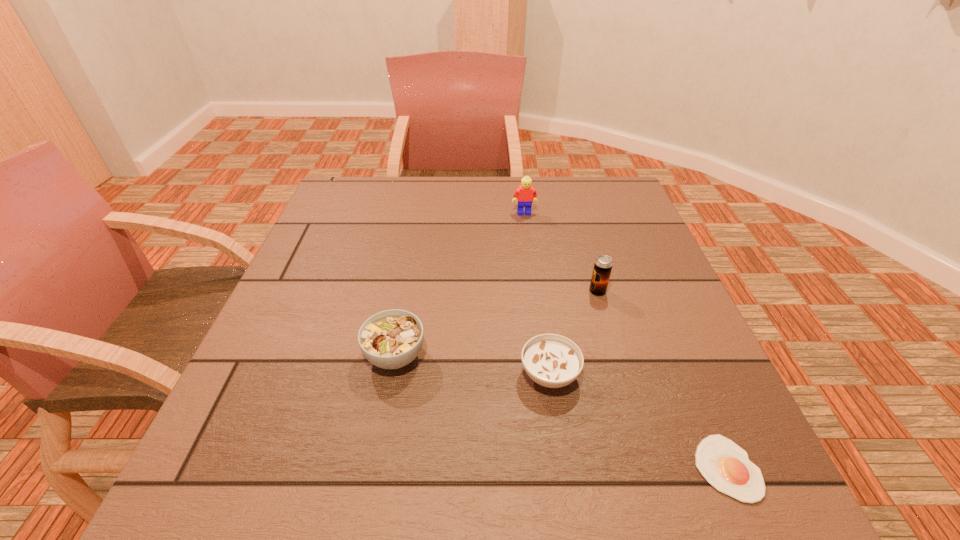
The image size is (960, 540). In order to click on free space between the rightmost object and the leftmost object in this screenshot , I will do `click(561, 411)`.

Locate an element on the screen. unoccupied position between the taller soup bowl and the fourth shortest object is located at coordinates tap(496, 323).

Where is `vacant space that is in between the third shortest object and the egg yolk`? Image resolution: width=960 pixels, height=540 pixels. vacant space that is in between the third shortest object and the egg yolk is located at coordinates (561, 411).

At what (x,y) coordinates should I click in order to perform the action: click on unoccupied area between the farthest object and the third shortest object. Please return your answer as a coordinate pair (x, y). Looking at the image, I should click on (460, 284).

At what (x,y) coordinates should I click in order to perform the action: click on vacant space that's between the right soup bowl and the third tallest object. Please return your answer as a coordinate pair (x, y). Looking at the image, I should click on (472, 365).

The image size is (960, 540). What are the coordinates of `object that is the closest one to the right soup bowl` in the screenshot? It's located at (726, 466).

Locate an element on the screen. This screenshot has height=540, width=960. object that is the closest to the fourth nearest object is located at coordinates (553, 361).

Find the location of `vacant point that satisfies the following two spatial constraints: 1. on the front side of the shorter soup bowl; 2. on the right side of the third tallest object`. vacant point that satisfies the following two spatial constraints: 1. on the front side of the shorter soup bowl; 2. on the right side of the third tallest object is located at coordinates (392, 374).

Find the location of a particular element. Image resolution: width=960 pixels, height=540 pixels. vacant space that satisfies the following two spatial constraints: 1. on the front-facing side of the shorter soup bowl; 2. on the right side of the tallest object is located at coordinates (546, 374).

Find the location of `free space in the image that satisfies the following two spatial constraints: 1. on the front-facing side of the shortest object; 2. on the left side of the tallest object`. free space in the image that satisfies the following two spatial constraints: 1. on the front-facing side of the shortest object; 2. on the left side of the tallest object is located at coordinates (560, 468).